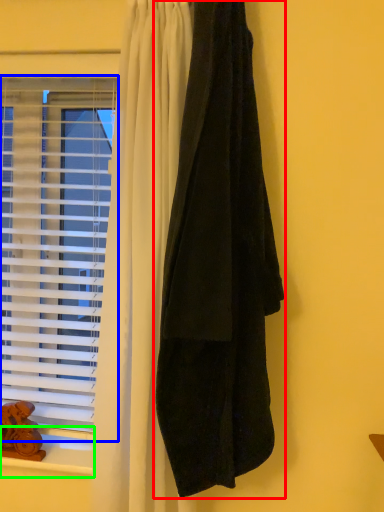
Question: Which object is the farthest from curtain (highlighted by a red box)? Choose among these: window (highlighted by a blue box) or window sill (highlighted by a green box).

Choices:
 (A) window
 (B) window sill

Answer: (B)